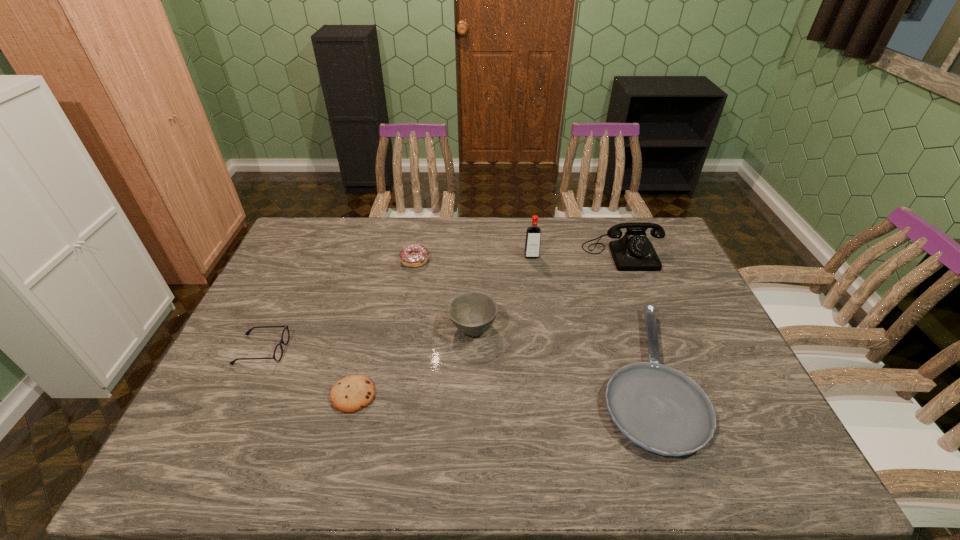
Locate an element on the screen. This screenshot has height=540, width=960. vacant area situated 0.270m on the front face of the telephone is located at coordinates (654, 333).

You are a GUI agent. You are given a task and a screenshot of the screen. Output one action in this format:
    pyautogui.click(x=<x>, y=<y>)
    Task: Click on the free space located on the right of the third tallest object
    The image size is (960, 540).
    Given the screenshot: What is the action you would take?
    pyautogui.click(x=521, y=328)

In order to click on vacant space situated 0.110m on the left of the doughnut in this screenshot , I will do `click(368, 260)`.

At what (x,y) coordinates should I click in order to perform the action: click on vacant area situated on the front-facing side of the spectacles. Please return your answer as a coordinate pair (x, y). The width and height of the screenshot is (960, 540). Looking at the image, I should click on (410, 350).

The width and height of the screenshot is (960, 540). Identify the location of free region located on the back of the frying pan. (613, 287).

Where is `blank area located on the right of the cookie`? The width and height of the screenshot is (960, 540). blank area located on the right of the cookie is located at coordinates (513, 395).

The width and height of the screenshot is (960, 540). I want to click on vodka at the far edge, so click(x=533, y=233).

This screenshot has width=960, height=540. In order to click on telephone at the far edge in this screenshot , I will do `click(633, 252)`.

Identify the location of doughnut that is at the far edge. This screenshot has width=960, height=540. (416, 255).

This screenshot has width=960, height=540. What are the coordinates of `object at the near edge` in the screenshot? It's located at (659, 408).